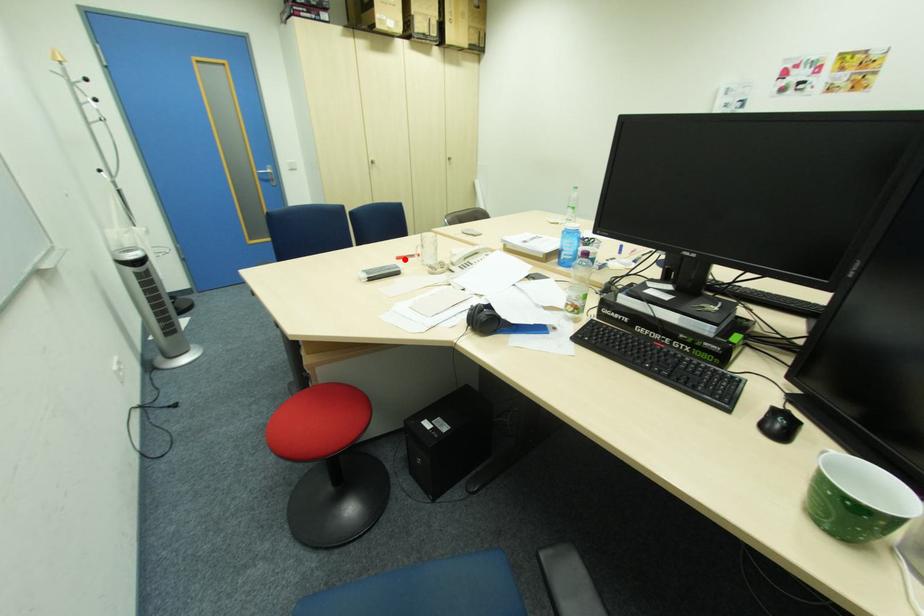
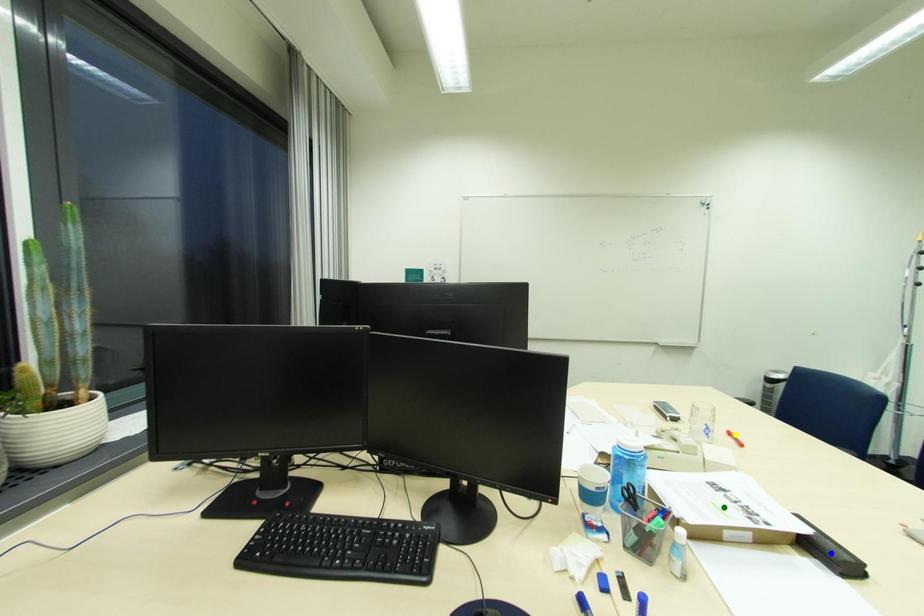
Question: I am providing you with two images of the same scene from different viewpoints. A red point is marked on the first image. You are given multiple points on the second image. Which point in image 2 is actually the same real-world point as the red point in image 1?

Choices:
 (A) blue point
 (B) green point
 (C) yellow point

Answer: (C)